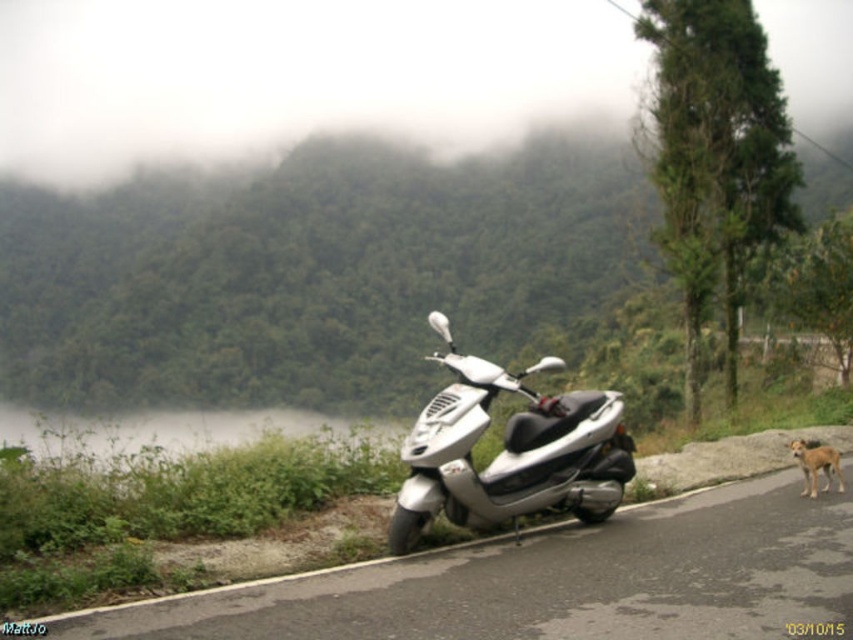
Can you confirm if metallic silver scooter at center is bigger than brown fur dog at lower right?

Incorrect, metallic silver scooter at center is not larger than brown fur dog at lower right.

Who is lower down, metallic silver scooter at center or brown fur dog at lower right?

metallic silver scooter at center is lower down.

Between point (544, 554) and point (805, 474), which one is positioned behind?

The point (805, 474) is behind.

Where is `metallic silver scooter at center`? Image resolution: width=853 pixels, height=640 pixels. metallic silver scooter at center is located at coordinates (550, 580).

Which is in front, point (437, 480) or point (811, 483)?

Point (437, 480) is more forward.

Measure the distance between silver metallic scooter at center and camera.

silver metallic scooter at center is 23.93 feet from camera.

Locate an element on the screen. silver metallic scooter at center is located at coordinates (508, 451).

Does metallic silver scooter at center have a greater height compared to silver metallic scooter at center?

In fact, metallic silver scooter at center may be shorter than silver metallic scooter at center.

Is point (271, 632) more distant than point (473, 483)?

No, it is in front of (473, 483).

Describe the element at coordinates (550, 580) in the screenshot. This screenshot has height=640, width=853. I see `metallic silver scooter at center` at that location.

Find the location of `metallic silver scooter at center`. metallic silver scooter at center is located at coordinates pos(550,580).